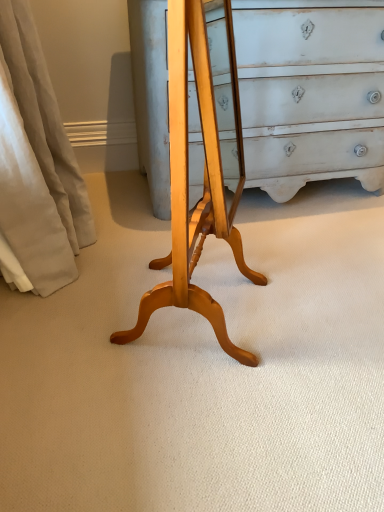
Question: Is light wood changing table at center bigger than beige fabric curtain at left?

Choices:
 (A) no
 (B) yes

Answer: (A)

Question: Is light wood changing table at center placed right next to beige fabric curtain at left?

Choices:
 (A) no
 (B) yes

Answer: (A)

Question: Is light wood changing table at center oriented towards beige fabric curtain at left?

Choices:
 (A) yes
 (B) no

Answer: (B)

Question: Does light wood changing table at center lie behind beige fabric curtain at left?

Choices:
 (A) yes
 (B) no

Answer: (B)

Question: Can beige fabric curtain at left be found inside light wood changing table at center?

Choices:
 (A) no
 (B) yes

Answer: (A)

Question: Can we say light wood changing table at center lies outside beige fabric curtain at left?

Choices:
 (A) no
 (B) yes

Answer: (B)

Question: From the image's perspective, would you say beige fabric curtain at left is shown under light wood changing table at center?

Choices:
 (A) no
 (B) yes

Answer: (A)

Question: Can you confirm if beige fabric curtain at left is wider than light wood changing table at center?

Choices:
 (A) no
 (B) yes

Answer: (B)

Question: Is beige fabric curtain at left at the right side of light wood changing table at center?

Choices:
 (A) no
 (B) yes

Answer: (A)

Question: From the image's perspective, is beige fabric curtain at left on top of light wood changing table at center?

Choices:
 (A) yes
 (B) no

Answer: (A)

Question: Is beige fabric curtain at left closer to the viewer compared to light wood changing table at center?

Choices:
 (A) no
 (B) yes

Answer: (A)

Question: Can you confirm if beige fabric curtain at left is thinner than light wood changing table at center?

Choices:
 (A) yes
 (B) no

Answer: (B)

Question: Is beige fabric curtain at left taller or shorter than light wood changing table at center?

Choices:
 (A) short
 (B) tall

Answer: (A)